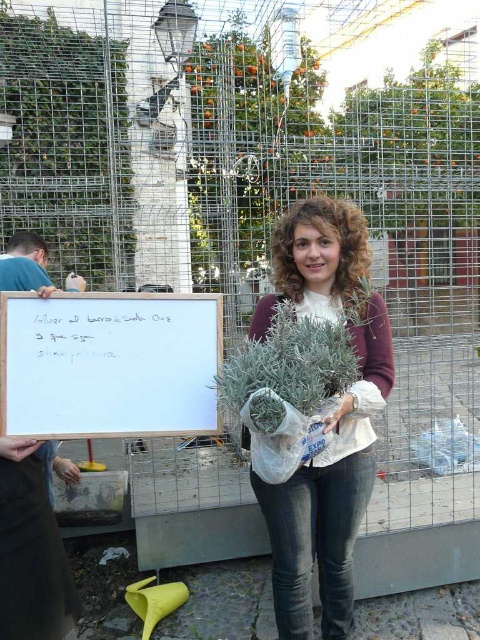
Between white wooden board at center and green leafy plant at center, which one is positioned higher?

white wooden board at center is higher up.

Does point (208, 424) come closer to viewer compared to point (231, 400)?

No, it is not.

Identify the location of white wooden board at center. The height and width of the screenshot is (640, 480). point(109,364).

Between matte white sweater at center and white wooden board at center, which one is positioned higher?

white wooden board at center is above.

Is point (368, 384) closer to camera compared to point (156, 426)?

No, it is behind (156, 426).

This screenshot has width=480, height=640. What do you see at coordinates (324, 419) in the screenshot?
I see `matte white sweater at center` at bounding box center [324, 419].

Where is `matte white sweater at center`? The width and height of the screenshot is (480, 640). matte white sweater at center is located at coordinates (324, 419).

In the scene shown: Can you confirm if matte white sweater at center is bigger than green leafy plant at center?

Indeed, matte white sweater at center has a larger size compared to green leafy plant at center.

Who is more distant from viewer, (338, 308) or (278, 301)?

Positioned behind is point (338, 308).

The image size is (480, 640). In order to click on matte white sweater at center in this screenshot , I will do `click(324, 419)`.